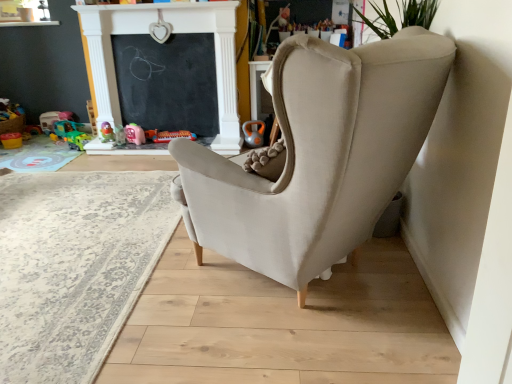
Question: From a real-world perspective, is matte plastic kettlebell at center, placed as the 1th toy when sorted from right to left, below beige fabric rug at lower left?

Choices:
 (A) no
 (B) yes

Answer: (A)

Question: From a real-world perspective, is matte plastic kettlebell at center, arranged as the 7th toy when viewed from the left, positioned over beige fabric rug at lower left based on gravity?

Choices:
 (A) yes
 (B) no

Answer: (A)

Question: Is beige fabric rug at lower left completely or partially inside matte plastic kettlebell at center, arranged as the 7th toy when viewed from the left?

Choices:
 (A) yes
 (B) no

Answer: (B)

Question: Can you confirm if matte plastic kettlebell at center, placed as the 1th toy when sorted from right to left, is positioned to the right of beige fabric rug at lower left?

Choices:
 (A) yes
 (B) no

Answer: (A)

Question: From the image's perspective, would you say matte plastic kettlebell at center, placed as the 1th toy when sorted from right to left, is shown under beige fabric rug at lower left?

Choices:
 (A) no
 (B) yes

Answer: (A)

Question: Is matte plastic kettlebell at center, arranged as the 7th toy when viewed from the left, far from beige fabric rug at lower left?

Choices:
 (A) yes
 (B) no

Answer: (A)

Question: Can you confirm if matte yellow toy at left, positioned as the 7th toy in right-to-left order, is bigger than matte plastic kettlebell at center, placed as the 1th toy when sorted from right to left?

Choices:
 (A) yes
 (B) no

Answer: (B)

Question: Is matte yellow toy at left, the 1th toy when ordered from left to right, thinner than matte plastic kettlebell at center, placed as the 1th toy when sorted from right to left?

Choices:
 (A) yes
 (B) no

Answer: (B)

Question: From the image's perspective, is matte yellow toy at left, positioned as the 7th toy in right-to-left order, under matte plastic kettlebell at center, placed as the 1th toy when sorted from right to left?

Choices:
 (A) no
 (B) yes

Answer: (B)

Question: Is matte yellow toy at left, the 1th toy when ordered from left to right, looking in the opposite direction of matte plastic kettlebell at center, placed as the 1th toy when sorted from right to left?

Choices:
 (A) yes
 (B) no

Answer: (B)

Question: Is matte yellow toy at left, the 1th toy when ordered from left to right, touching matte plastic kettlebell at center, placed as the 1th toy when sorted from right to left?

Choices:
 (A) yes
 (B) no

Answer: (B)

Question: Considering the relative sizes of matte yellow toy at left, positioned as the 7th toy in right-to-left order, and matte plastic kettlebell at center, placed as the 1th toy when sorted from right to left, in the image provided, is matte yellow toy at left, positioned as the 7th toy in right-to-left order, taller than matte plastic kettlebell at center, placed as the 1th toy when sorted from right to left,?

Choices:
 (A) no
 (B) yes

Answer: (A)

Question: From the image's perspective, is matte plastic toy at center, marked as the 4th toy in a left-to-right arrangement, on top of matte plastic kettlebell at center, arranged as the 7th toy when viewed from the left?

Choices:
 (A) yes
 (B) no

Answer: (A)